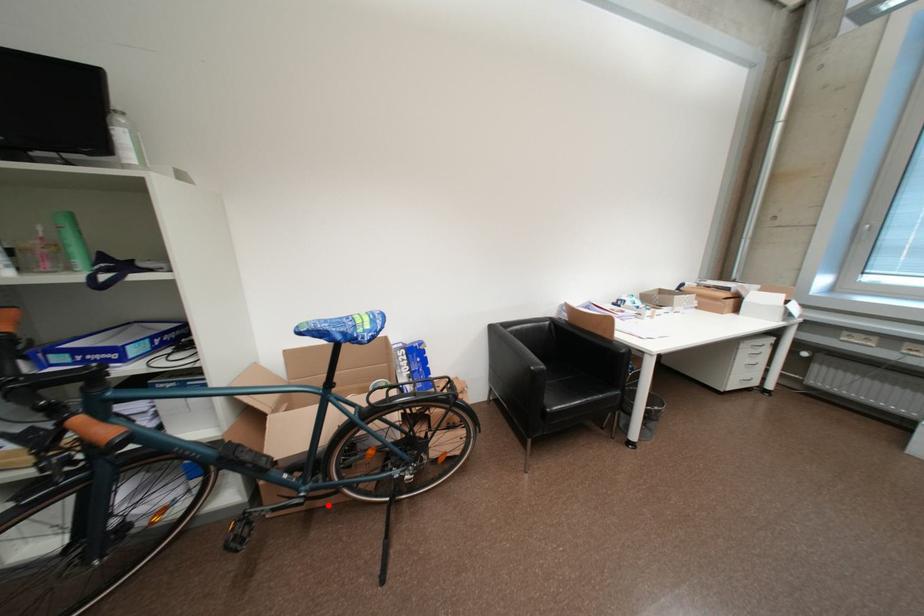
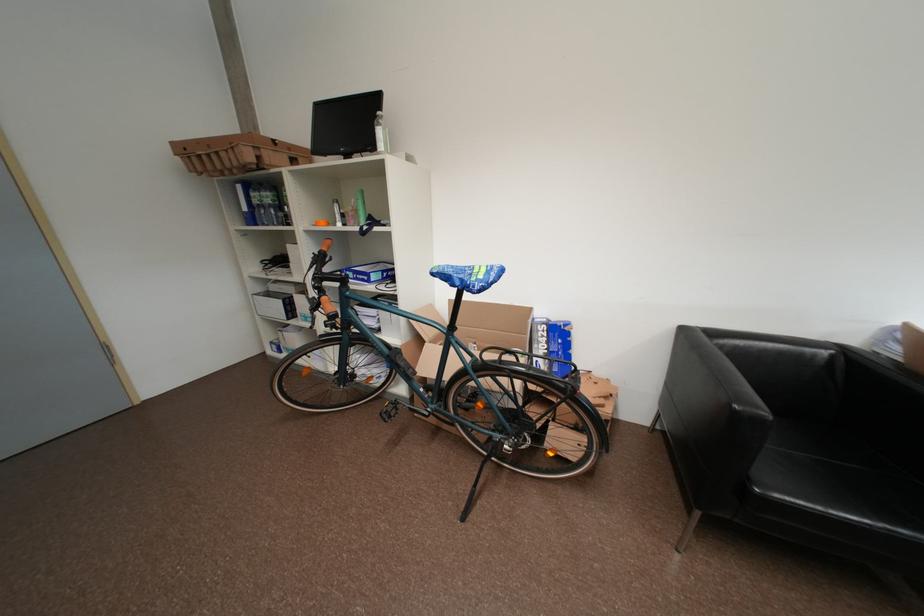
Where in the second image is the point corresponding to the highlighted location from the first image?

(454, 429)